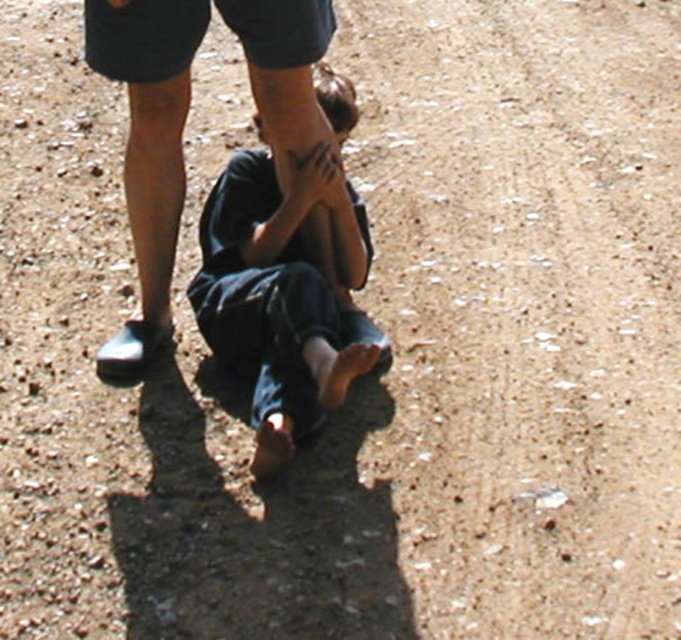
You are a photographer trying to capture both the dark blue jeans at center and the dark blue jeans at lower center in a single frame. Based on their positions, which one is closer to the camera?

The dark blue jeans at lower center is closer to the camera because the dark blue jeans at center is positioned under it, indicating it is behind in the depth of field.

You are a rescue worker trying to locate two people in a dangerous area. You see two sets of dark blue jeans at center and dark blue jeans at lower center. Based on their positions, which set of dark blue jeans is closer to you?

The dark blue jeans at center is in front of dark blue jeans at lower center, so the dark blue jeans at center is closer to you.

In the scene shown: You are a photographer who needs to capture a clear photo of the dark blue jeans at center. Your camera is 9.23 feet away from the jeans. Is this distance within the minimum focusing distance of most standard cameras, which is typically around 2 feet? Explain your answer using the given information.

The dark blue jeans at center and camera are 9.23 feet apart. Since most standard cameras have a minimum focusing distance of around 2 feet, 9.23 feet is well beyond this distance. Therefore, the photographer can easily capture a clear photo of the dark blue jeans at center as the distance is sufficient for focusing.